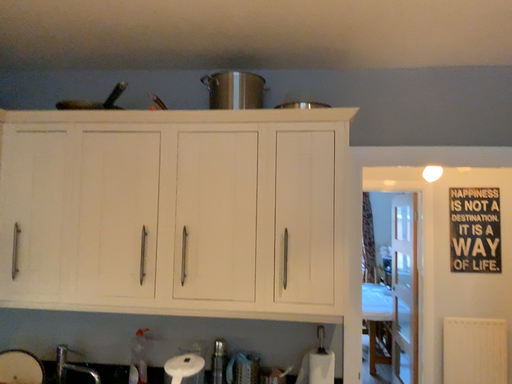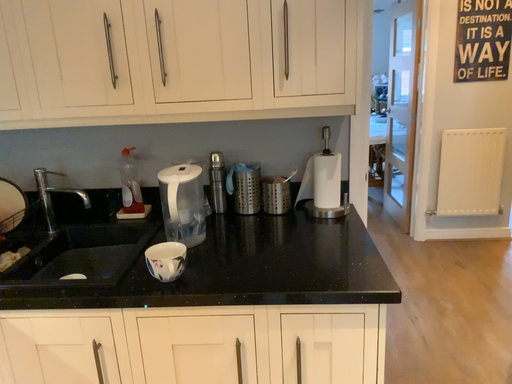
Question: Which way did the camera rotate in the video?

Choices:
 (A) rotated downward
 (B) rotated upward

Answer: (A)